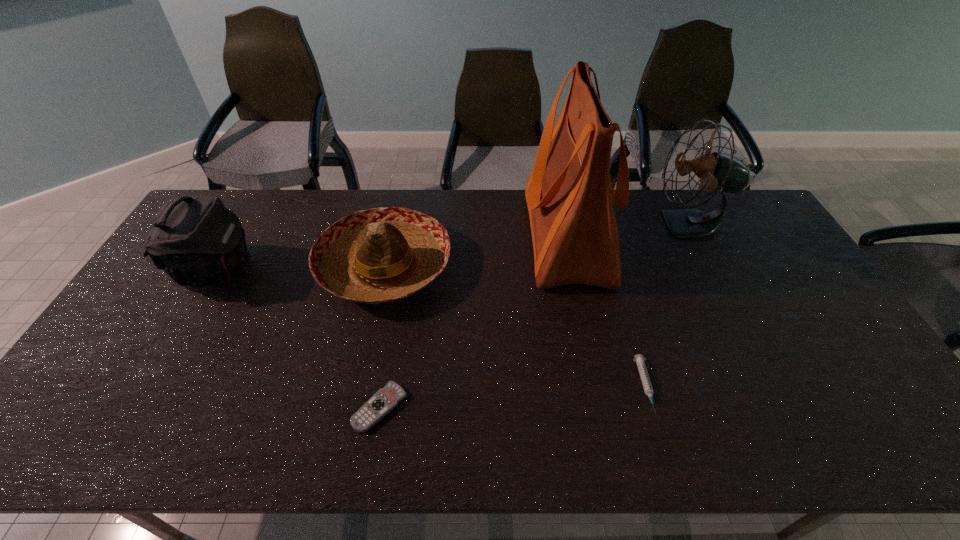
The height and width of the screenshot is (540, 960). In order to click on syringe at the near edge in this screenshot , I will do `click(639, 359)`.

You are a GUI agent. You are given a task and a screenshot of the screen. Output one action in this format:
    pyautogui.click(x=<x>, y=<y>)
    Task: Click on the remote control located at the near edge
    
    Given the screenshot: What is the action you would take?
    pyautogui.click(x=385, y=399)

The height and width of the screenshot is (540, 960). I want to click on object positioned at the left edge, so click(x=196, y=240).

Where is `object at the right edge`? object at the right edge is located at coordinates (717, 171).

This screenshot has height=540, width=960. What are the coordinates of `object present at the far right corner` in the screenshot? It's located at (717, 171).

This screenshot has height=540, width=960. Identify the location of free space at the far edge. (465, 212).

Where is `vacant area at the right edge`? vacant area at the right edge is located at coordinates (852, 362).

Find the location of `vacant area at the far right corner of the desktop`. vacant area at the far right corner of the desktop is located at coordinates (749, 231).

Identify the location of free area in between the shortest object and the fifth tallest object. The width and height of the screenshot is (960, 540). (513, 397).

Identify the location of vacant area that lies between the syringe and the rightmost object. (667, 306).